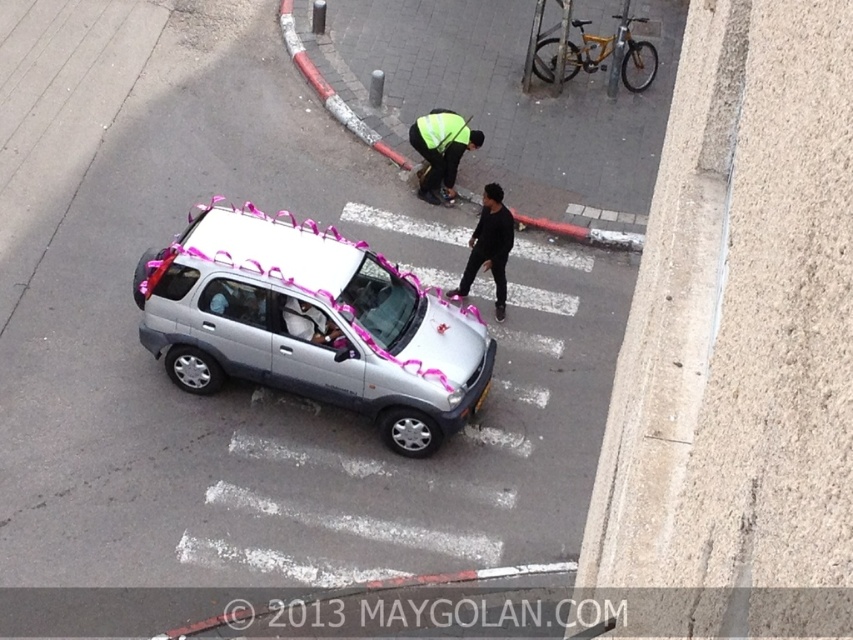
In the scene shown: Is reflective yellow vest at center below black matte clothing at center?

Incorrect, reflective yellow vest at center is not positioned below black matte clothing at center.

Does reflective yellow vest at center have a lesser width compared to black matte clothing at center?

Incorrect, reflective yellow vest at center's width is not less than black matte clothing at center's.

Between point (409, 134) and point (502, 317), which one is positioned in front?

Positioned in front is point (502, 317).

Where is `reflective yellow vest at center`? The image size is (853, 640). reflective yellow vest at center is located at coordinates (440, 150).

Does silver metallic car at center appear over reflective yellow safety vest at center?

No.

Between point (193, 237) and point (457, 128), which one is positioned behind?

The point (457, 128) is behind.

Where is `silver metallic car at center`? silver metallic car at center is located at coordinates (311, 323).

Identify the location of silver metallic car at center. The image size is (853, 640). (311, 323).

In the scene shown: Is reflective yellow vest at center further to camera compared to reflective yellow safety vest at center?

No, reflective yellow vest at center is in front of reflective yellow safety vest at center.

The width and height of the screenshot is (853, 640). What are the coordinates of `reflective yellow vest at center` in the screenshot? It's located at (440, 150).

This screenshot has width=853, height=640. I want to click on reflective yellow vest at center, so click(x=440, y=150).